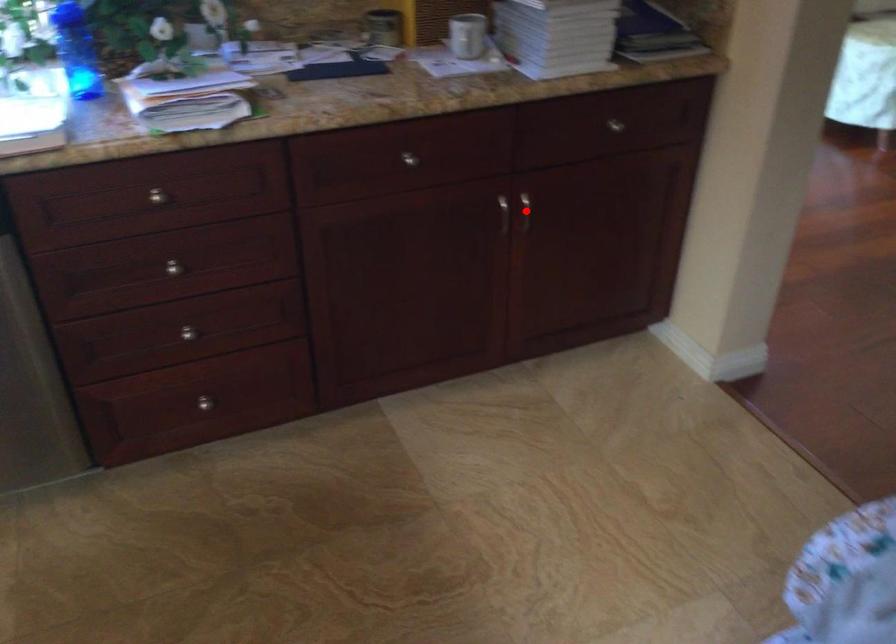
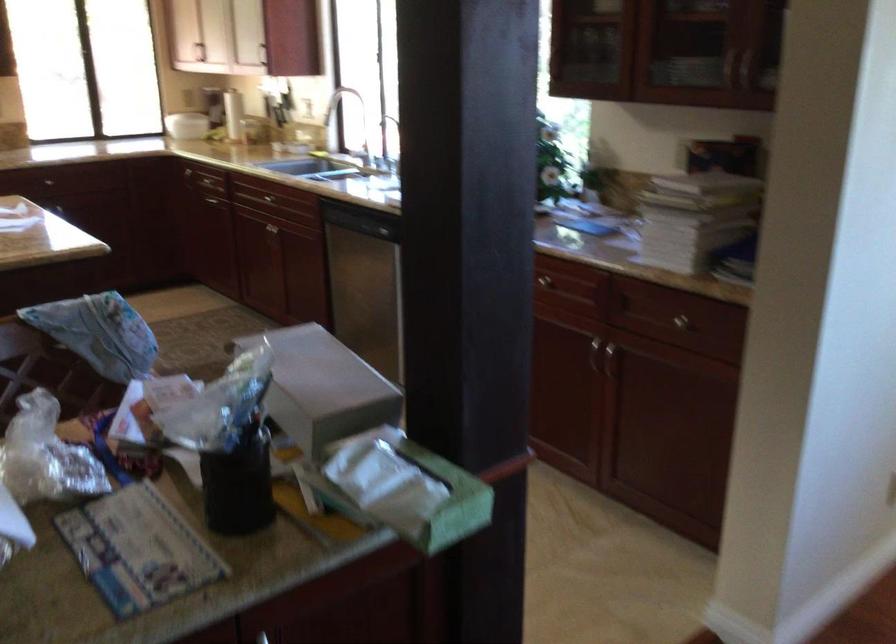
Question: I am providing you with two images of the same scene from different viewpoints. In image1, a red point is highlighted. Considering the same 3D point in image2, which of the following is correct?

Choices:
 (A) It is closer
 (B) It is farther

Answer: (B)